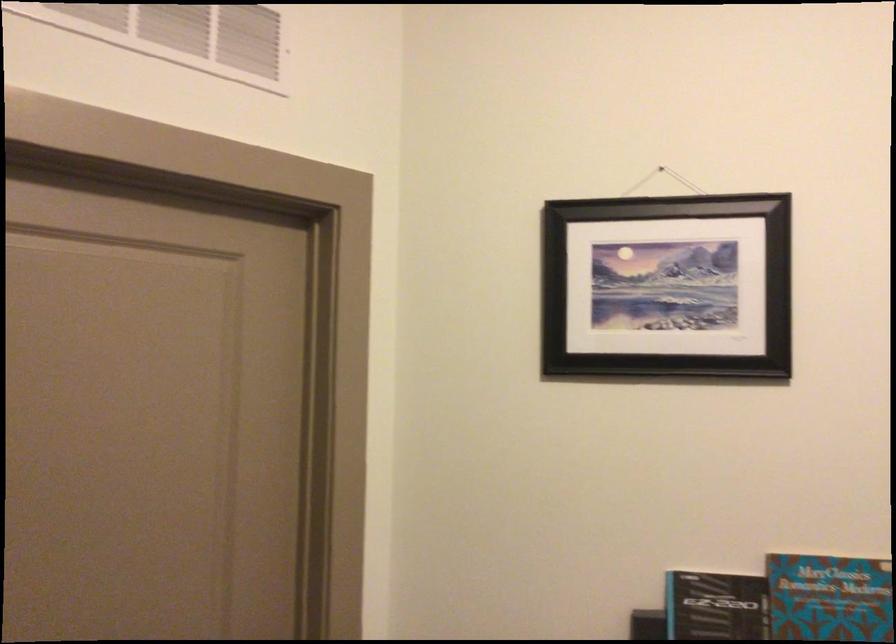
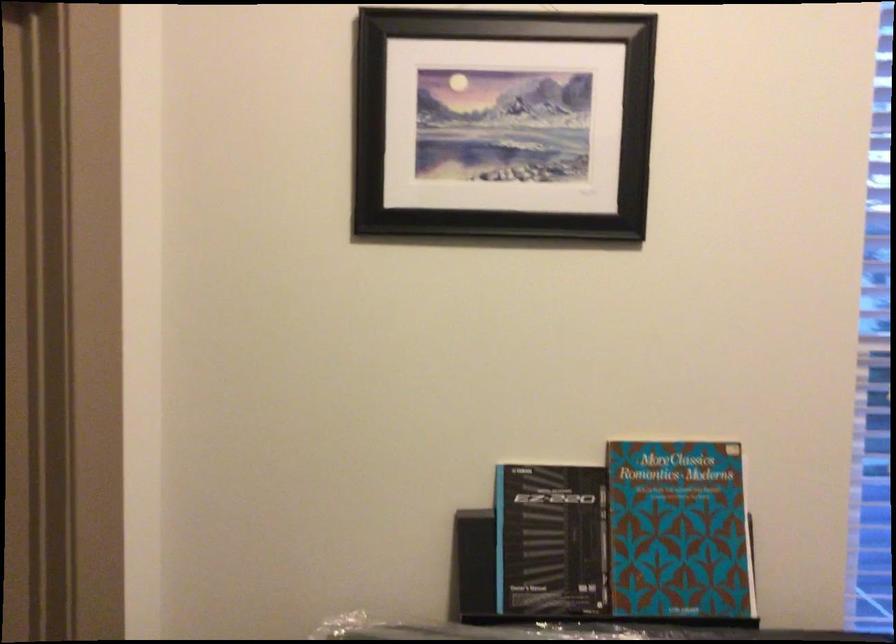
Question: The first image is from the beginning of the video and the second image is from the end. How did the camera likely rotate when shooting the video?

Choices:
 (A) Left
 (B) Right
 (C) Up
 (D) Down

Answer: (B)